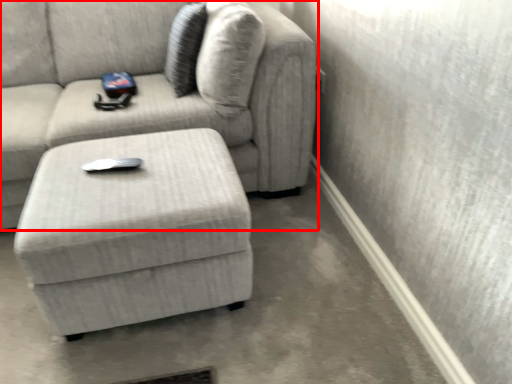
Question: From the image's perspective, where is studio couch (annotated by the red box) located in relation to table in the image?

Choices:
 (A) above
 (B) below

Answer: (A)